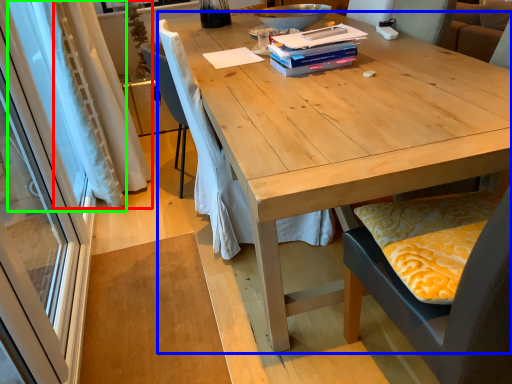
Question: Which object is the farthest from curtain (highlighted by a red box)? Choose among these: desk (highlighted by a blue box) or curtain (highlighted by a green box).

Choices:
 (A) desk
 (B) curtain

Answer: (A)